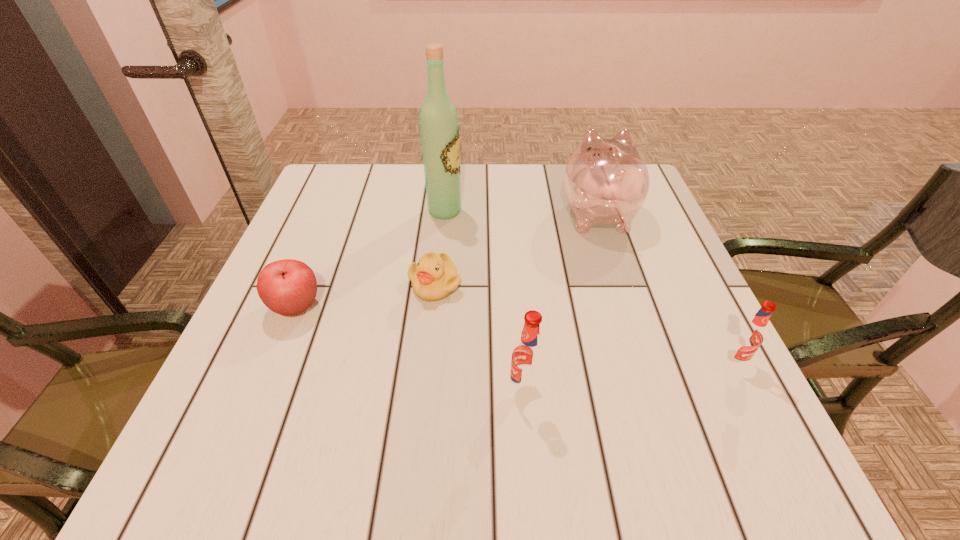
At what (x,y) coordinates should I click in order to perform the action: click on the left root beer. Please return your answer as a coordinate pair (x, y). The width and height of the screenshot is (960, 540). Looking at the image, I should click on (528, 356).

Find the location of a particular element. the nearer root beer is located at coordinates (528, 356).

Find the location of a particular element. Image resolution: width=960 pixels, height=540 pixels. the shorter root beer is located at coordinates tap(749, 336).

I want to click on the rightmost object, so click(749, 336).

The height and width of the screenshot is (540, 960). In order to click on wine bottle in this screenshot , I will do [439, 128].

Image resolution: width=960 pixels, height=540 pixels. I want to click on piggy bank, so click(606, 181).

Find the location of a particular element. Image resolution: width=960 pixels, height=540 pixels. the leftmost object is located at coordinates (288, 287).

Where is `the fifth tallest object`? Image resolution: width=960 pixels, height=540 pixels. the fifth tallest object is located at coordinates (288, 287).

Where is `the shortest object`? Image resolution: width=960 pixels, height=540 pixels. the shortest object is located at coordinates (435, 277).

Where is `vacant area situated on the left of the taller root beer`? Image resolution: width=960 pixels, height=540 pixels. vacant area situated on the left of the taller root beer is located at coordinates click(x=426, y=389).